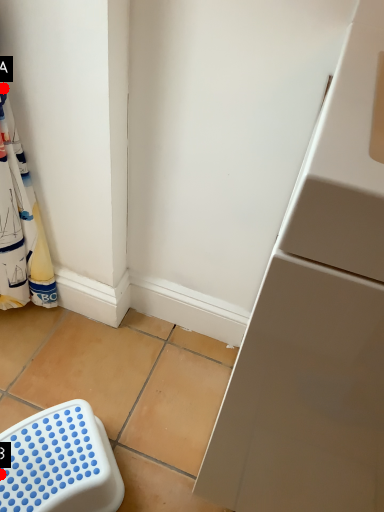
Question: Two points are circled on the image, labeled by A and B beside each circle. Which point is farther to the camera?

Choices:
 (A) A is further
 (B) B is further

Answer: (A)